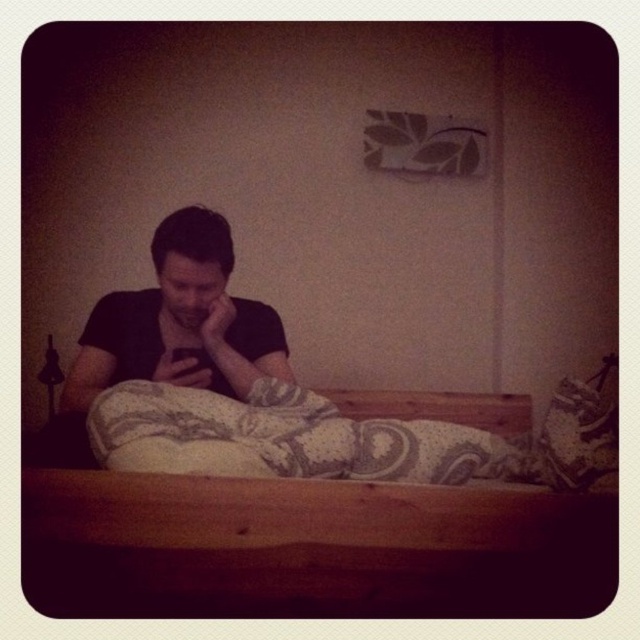
In the scene shown: You are a fashion designer trying to create a new clothing line. You observe the black matte shirt at center and the black matte hand at center in the image. Which item has a greater width?

The black matte shirt at center has a greater width than the black matte hand at center.